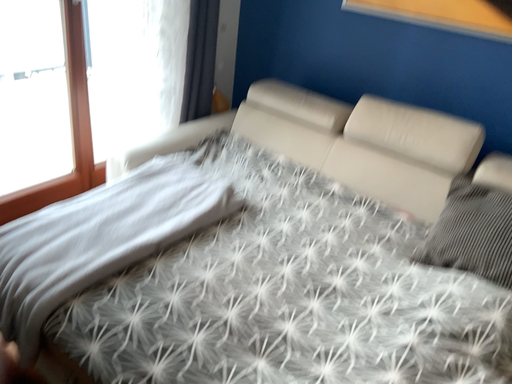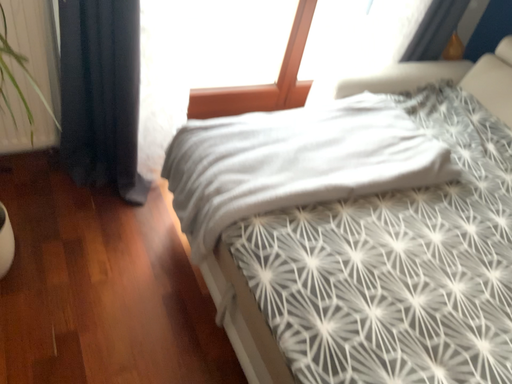
Question: Which way did the camera rotate in the video?

Choices:
 (A) rotated left
 (B) rotated right

Answer: (A)